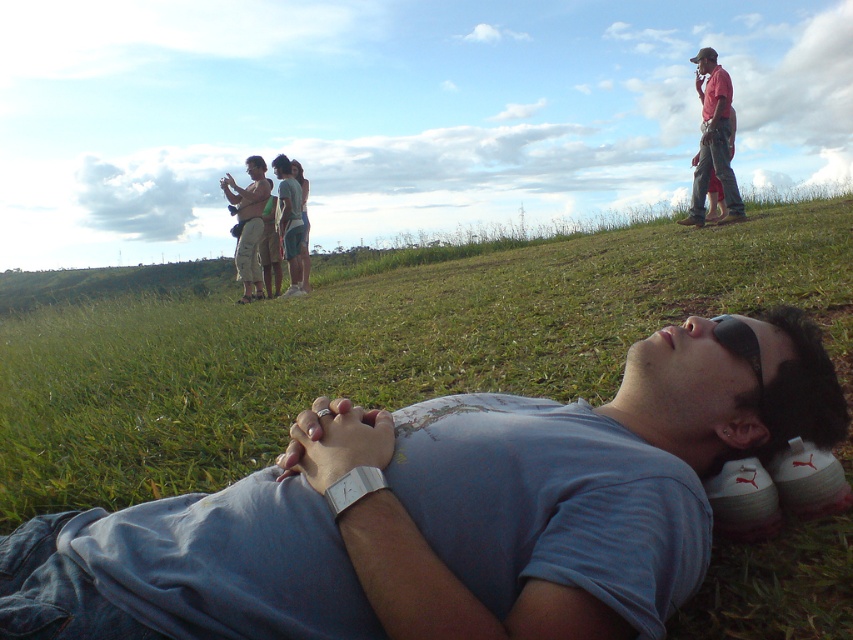
Question: In this image, where is matte pink shirt at upper right located relative to beige cotton shorts at center?

Choices:
 (A) below
 (B) above

Answer: (B)

Question: Which object is farther from the camera taking this photo?

Choices:
 (A) beige cotton shorts at center
 (B) blue cotton shirt at lower center
 (C) matte pink shirt at upper right

Answer: (A)

Question: Is matte pink shirt at upper right to the right of beige cotton shorts at center from the viewer's perspective?

Choices:
 (A) yes
 (B) no

Answer: (A)

Question: Among these objects, which one is farthest from the camera?

Choices:
 (A) matte pink shirt at upper right
 (B) beige cotton shorts at center

Answer: (B)

Question: Which point is closer to the camera?

Choices:
 (A) (258, 202)
 (B) (335, 586)

Answer: (B)

Question: Is blue cotton shirt at lower center above beige cotton shorts at center?

Choices:
 (A) yes
 (B) no

Answer: (B)